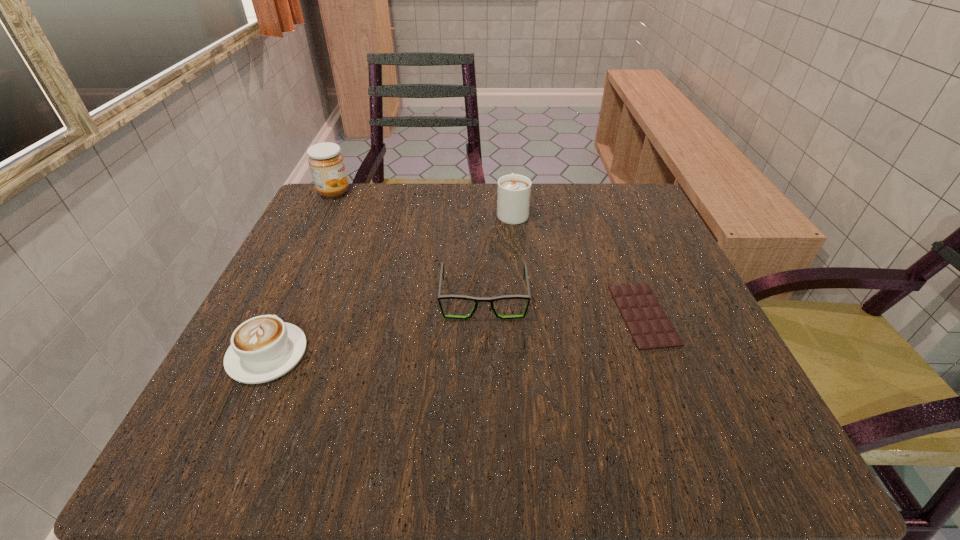
In the image, there is a desktop. Where is `free space at the far edge`? free space at the far edge is located at coordinates (434, 191).

Image resolution: width=960 pixels, height=540 pixels. In the image, there is a desktop. In order to click on vacant space at the near edge in this screenshot , I will do `click(439, 426)`.

Identify the location of vacant region at the left edge of the desktop. This screenshot has height=540, width=960. (300, 296).

In the image, there is a desktop. Where is `vacant space at the right edge`? The width and height of the screenshot is (960, 540). vacant space at the right edge is located at coordinates (695, 320).

In the image, there is a desktop. At what (x,y) coordinates should I click in order to perform the action: click on vacant space at the far left corner. Please return your answer as a coordinate pair (x, y). Looking at the image, I should click on (377, 195).

This screenshot has height=540, width=960. I want to click on vacant space at the far right corner of the desktop, so click(590, 221).

I want to click on free region at the near right corner, so click(669, 410).

Image resolution: width=960 pixels, height=540 pixels. What are the coordinates of `vacant area that lies between the right cappuccino and the shortest object` in the screenshot? It's located at (578, 263).

Locate an element on the screen. This screenshot has width=960, height=540. free point between the chocolate bar and the farther cappuccino is located at coordinates (578, 263).

This screenshot has width=960, height=540. What are the coordinates of `vacant space that's between the tallest object and the rightmost object` in the screenshot? It's located at (489, 254).